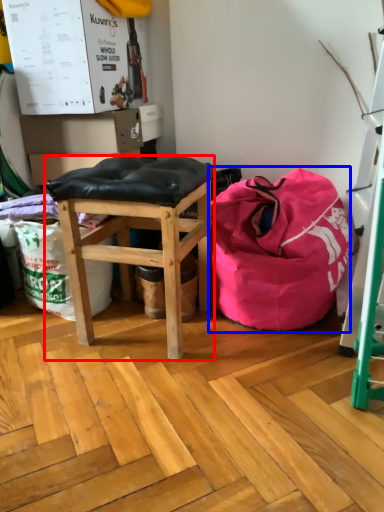
Question: Which object appears farthest to the camera in this image, stool (highlighted by a red box) or bean bag chair (highlighted by a blue box)?

Choices:
 (A) stool
 (B) bean bag chair

Answer: (B)